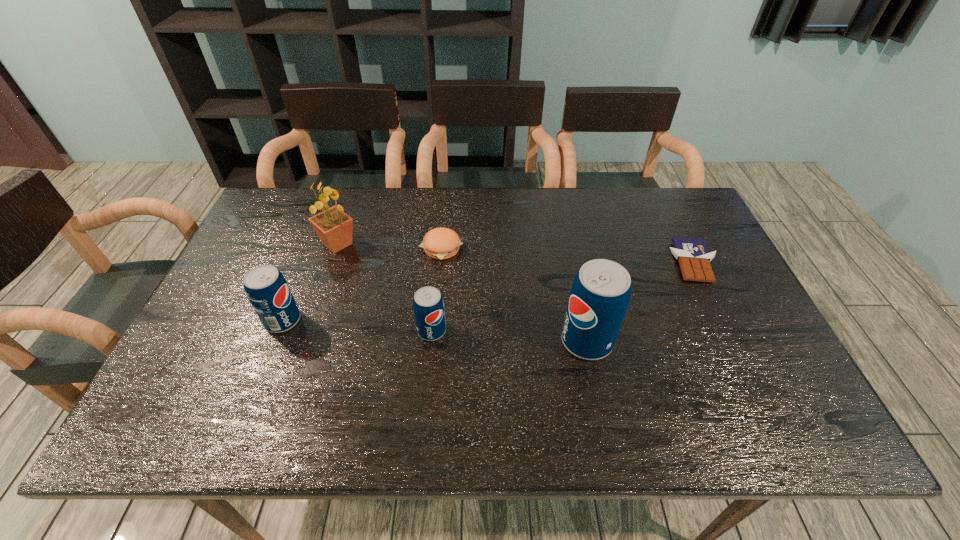
You are a GUI agent. You are given a task and a screenshot of the screen. Output one action in this format:
    pyautogui.click(x=<x>, y=<y>)
    Task: Click on the vacant region located on the left of the leftmost pop
    The height and width of the screenshot is (540, 960).
    Given the screenshot: What is the action you would take?
    pyautogui.click(x=214, y=321)

Identify the location of vacant space situated 0.280m on the left of the shortest pop. (305, 330).

At what (x,y) coordinates should I click in order to perform the action: click on free space located 0.240m on the back of the rightmost pop. Please return your answer as a coordinate pair (x, y). Looking at the image, I should click on (569, 256).

The image size is (960, 540). What are the coordinates of `free space located on the left of the fifth tallest object` in the screenshot? It's located at (382, 248).

This screenshot has width=960, height=540. Identify the location of free space located at the front of the sunflower with flowers visible. (425, 244).

Locate an element on the screen. vacant space located 0.150m on the left of the shortest object is located at coordinates (619, 262).

You are a GUI agent. You are given a task and a screenshot of the screen. Output one action in this format:
    pyautogui.click(x=<x>, y=<y>)
    Task: Click on the object located at the far edge
    
    Given the screenshot: What is the action you would take?
    pyautogui.click(x=334, y=227)

At what (x,y) coordinates should I click in order to perform the action: click on object located at the near edge. Please return your answer as a coordinate pair (x, y). The width and height of the screenshot is (960, 540). Looking at the image, I should click on (600, 294).

Locate an element on the screen. The image size is (960, 540). object that is at the left edge is located at coordinates (266, 288).

Locate an element on the screen. object that is at the right edge is located at coordinates (694, 259).